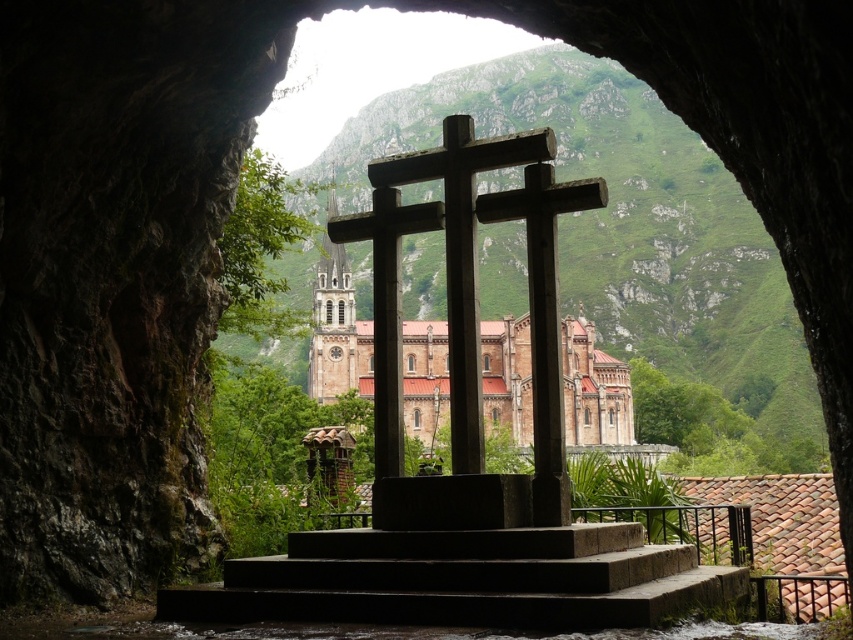
Is dark gray concrete stairs at center wider than rustic wood cross at center?

Indeed, dark gray concrete stairs at center has a greater width compared to rustic wood cross at center.

Locate an element on the screen. The image size is (853, 640). dark gray concrete stairs at center is located at coordinates (463, 580).

Where is `dark gray concrete stairs at center`? This screenshot has width=853, height=640. dark gray concrete stairs at center is located at coordinates (463, 580).